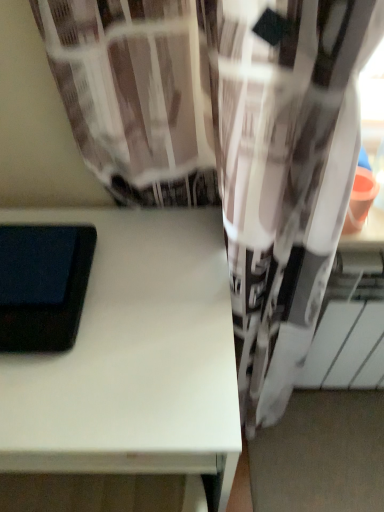
Question: Should I look upward or downward to see black matte tablet at left?

Choices:
 (A) up
 (B) down

Answer: (B)

Question: From the image's perspective, does white matte table at center appear lower than black matte tablet at left?

Choices:
 (A) yes
 (B) no

Answer: (A)

Question: Does white matte table at center have a lesser width compared to black matte tablet at left?

Choices:
 (A) yes
 (B) no

Answer: (B)

Question: Is white matte table at center facing towards black matte tablet at left?

Choices:
 (A) no
 (B) yes

Answer: (A)

Question: Is white matte table at center taller than black matte tablet at left?

Choices:
 (A) yes
 (B) no

Answer: (A)

Question: From the image's perspective, does white matte table at center appear higher than black matte tablet at left?

Choices:
 (A) no
 (B) yes

Answer: (A)

Question: Is black matte tablet at left at the back of white matte table at center?

Choices:
 (A) yes
 (B) no

Answer: (B)

Question: From a real-world perspective, is black matte tablet at left beneath white matte table at center?

Choices:
 (A) yes
 (B) no

Answer: (B)

Question: Is black matte tablet at left thinner than white matte table at center?

Choices:
 (A) yes
 (B) no

Answer: (A)

Question: From the image's perspective, is black matte tablet at left on white matte table at center?

Choices:
 (A) no
 (B) yes

Answer: (B)

Question: Can you confirm if black matte tablet at left is wider than white matte table at center?

Choices:
 (A) no
 (B) yes

Answer: (A)

Question: Is black matte tablet at left shorter than white matte table at center?

Choices:
 (A) no
 (B) yes

Answer: (B)

Question: Is black matte tablet at left taller than white matte table at center?

Choices:
 (A) yes
 (B) no

Answer: (B)

Question: Considering the positions of black matte tablet at left and white matte table at center in the image, is black matte tablet at left taller or shorter than white matte table at center?

Choices:
 (A) short
 (B) tall

Answer: (A)